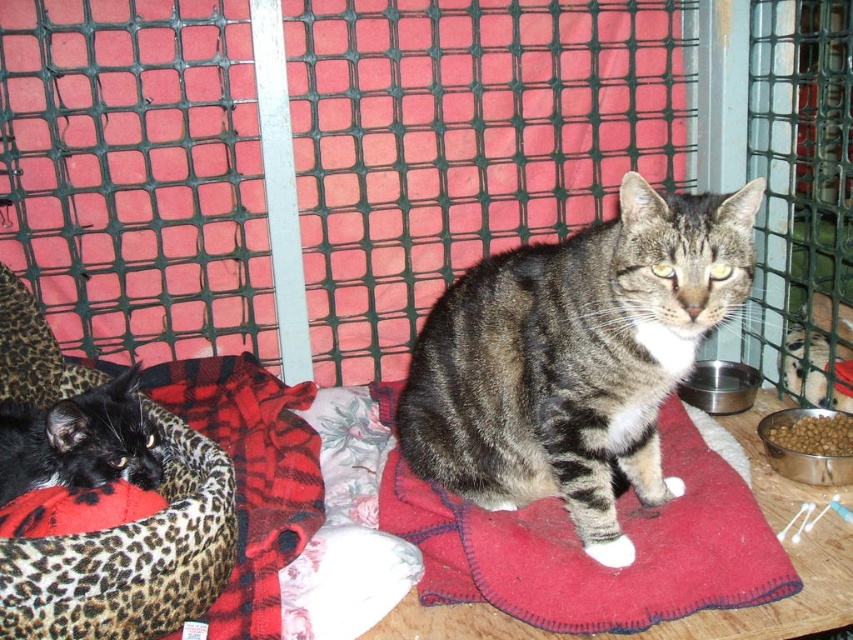
You are a photographer trying to capture a closeup of the tabby fur cat at center. You have a camera with a zoom lens that can focus on a specific point. The point you want to focus on is point (575, 356). Is this point located on the tabby fur cat at center?

Yes, the point (575, 356) is located on the tabby fur cat at center according to the provided information.

You are standing in the room where the two cats are resting. You notice two points marked in the scene. The first point is at coordinates point (575, 516) and the second is at point (813, 442). Which point is closer to you?

Point (575, 516) is in front of point (813, 442), so it is closer to you.

You are a cat owner who wants to place a small toy at point (741, 225) in the image. The toy requires a space that is at least 1.2 meters away from the viewer to avoid disturbing the cats. Is the distance sufficient?

The distance of point (741, 225) from the viewer is 1.15 meters, which is less than the required 1.2 meters. Therefore, placing the toy there may disturb the cats.